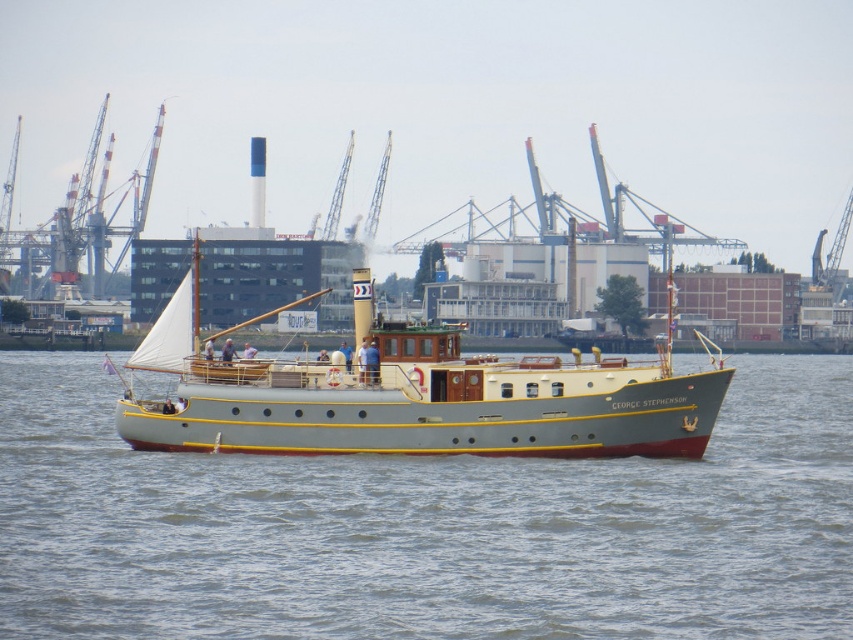
Question: Is smooth gray water at center to the left of light gray polished wood boat at center from the viewer's perspective?

Choices:
 (A) no
 (B) yes

Answer: (A)

Question: Is smooth gray water at center to the right of light gray polished wood boat at center from the viewer's perspective?

Choices:
 (A) yes
 (B) no

Answer: (A)

Question: Observing the image, what is the correct spatial positioning of smooth gray water at center in reference to light gray polished wood boat at center?

Choices:
 (A) above
 (B) below

Answer: (B)